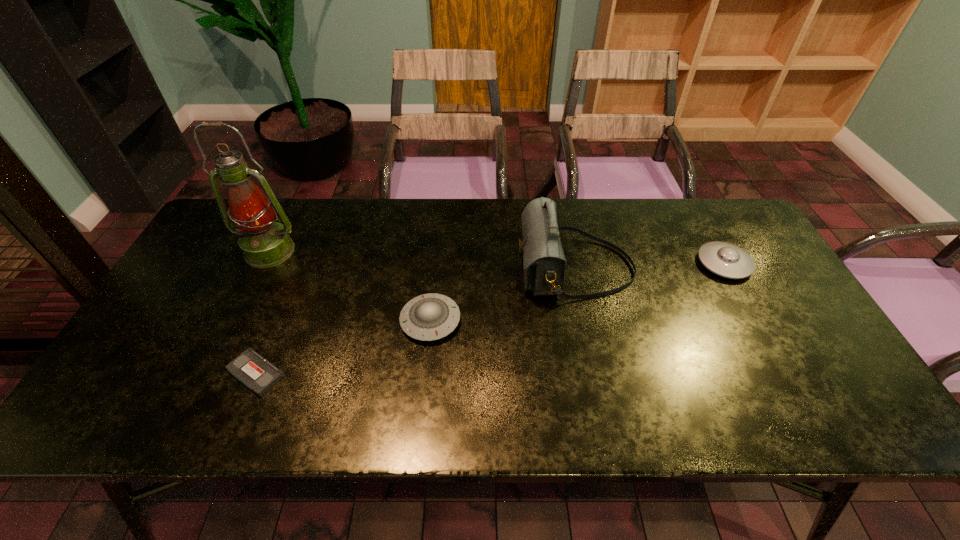
This screenshot has width=960, height=540. Identify the location of object present at the far left corner. 265,243.

Identify the location of object that is positioned at the far right corner. (727, 260).

Identify the location of vacant space at the far edge of the desktop. (492, 233).

Identify the location of vacant region at the near edge of the desktop. Image resolution: width=960 pixels, height=540 pixels. (315, 424).

The width and height of the screenshot is (960, 540). In the image, there is a desktop. Identify the location of vacant space at the left edge. (180, 321).

Image resolution: width=960 pixels, height=540 pixels. I want to click on vacant space at the far left corner, so click(x=206, y=239).

Locate an element on the screen. This screenshot has height=540, width=960. vacant region at the near left corner is located at coordinates (156, 422).

Image resolution: width=960 pixels, height=540 pixels. Identify the location of empty space that is in between the right saucer and the nearer saucer. (577, 292).

Locate an element on the screen. The height and width of the screenshot is (540, 960). vacant area that lies between the shoulder bag and the second shortest object is located at coordinates (503, 294).

Identify the location of vacant region between the rightmost object and the oil lamp. (497, 258).